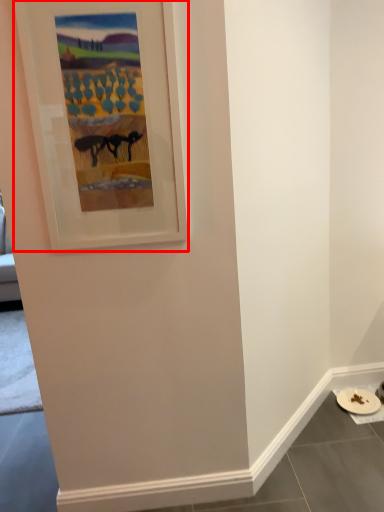
Question: From the image's perspective, what is the correct spatial positioning of picture frame (annotated by the red box) in reference to platter?

Choices:
 (A) below
 (B) above

Answer: (B)